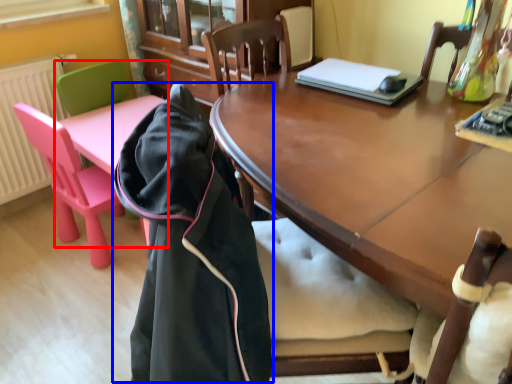
Question: Which of the following is the closest to the observer, chair (highlighted by a red box) or cloak (highlighted by a blue box)?

Choices:
 (A) chair
 (B) cloak

Answer: (B)